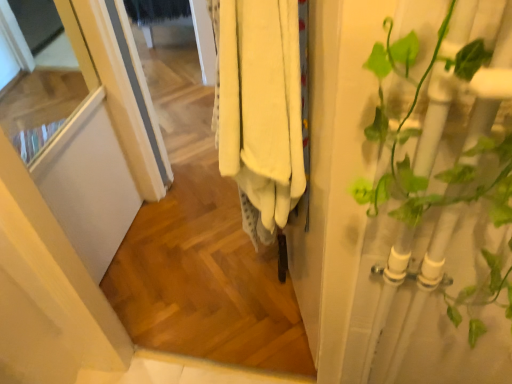
The image size is (512, 384). What do you see at coordinates (72, 145) in the screenshot?
I see `white matte screen door at left` at bounding box center [72, 145].

What do you see at coordinates (462, 147) in the screenshot? I see `green leafy plant at right` at bounding box center [462, 147].

Describe the element at coordinates (261, 106) in the screenshot. This screenshot has height=384, width=512. I see `white cotton towels at center` at that location.

Locate an element on the screen. The height and width of the screenshot is (384, 512). white matte screen door at left is located at coordinates (72, 145).

Is point (245, 109) positioned before point (4, 129)?

Yes, it is in front of point (4, 129).

Are white cotton towels at center and white matte screen door at left making contact?

No, white cotton towels at center is not touching white matte screen door at left.

Considering the sizes of objects white cotton towels at center and white matte screen door at left in the image provided, who is smaller, white cotton towels at center or white matte screen door at left?

Smaller between the two is white cotton towels at center.

From a real-world perspective, which is physically above, white cotton towels at center or white matte screen door at left?

white cotton towels at center is physically above.

Would you say white matte screen door at left is a long distance from green leafy plant at right?

Absolutely, white matte screen door at left is distant from green leafy plant at right.

From a real-world perspective, which is physically above, white matte screen door at left or green leafy plant at right?

From a 3D spatial view, green leafy plant at right is above.

Considering the positions of point (123, 189) and point (488, 8), is point (123, 189) closer or farther from the camera than point (488, 8)?

Point (123, 189) is farther from the camera than point (488, 8).

Is the depth of white matte screen door at left greater than that of green leafy plant at right?

Yes, white matte screen door at left is further from the camera.

Is green leafy plant at right oriented towards white cotton towels at center?

No, green leafy plant at right does not turn towards white cotton towels at center.

Based on the photo, measure the distance from green leafy plant at right to white cotton towels at center.

They are 35.85 centimeters apart.

Where is `houseplant beneath the white cotton towels at center (from a real-world perspective)`? The width and height of the screenshot is (512, 384). houseplant beneath the white cotton towels at center (from a real-world perspective) is located at coordinates (462, 147).

Are green leafy plant at right and white cotton towels at center located far from each other?

No.

Who is taller, green leafy plant at right or white matte screen door at left?

white matte screen door at left is taller.

From a real-world perspective, between green leafy plant at right and white matte screen door at left, who is vertically lower?

white matte screen door at left, from a real-world perspective.

Between green leafy plant at right and white matte screen door at left, which one has smaller width?

green leafy plant at right.

Is white matte screen door at left at the back of green leafy plant at right?

No, green leafy plant at right's orientation is not away from white matte screen door at left.

Between white cotton towels at center and green leafy plant at right, which one has larger size?

white cotton towels at center.

Which is in front, white cotton towels at center or green leafy plant at right?

green leafy plant at right is more forward.

From a real-world perspective, is white cotton towels at center physically above green leafy plant at right?

Correct, in the physical world, white cotton towels at center is higher than green leafy plant at right.

Are white matte screen door at left and white cotton towels at center located far from each other?

Yes.

Is white matte screen door at left positioned in front of white cotton towels at center?

No, white matte screen door at left is further to the viewer.

In terms of height, does white matte screen door at left look taller or shorter compared to white cotton towels at center?

Clearly, white matte screen door at left is taller compared to white cotton towels at center.

From the image's perspective, is white matte screen door at left over white cotton towels at center?

Yes, from the image's perspective, white matte screen door at left is over white cotton towels at center.

Where is `closet that appears below the white matte screen door at left (from the image's perspective)`? closet that appears below the white matte screen door at left (from the image's perspective) is located at coordinates (261, 106).

The width and height of the screenshot is (512, 384). I want to click on screen door beneath the green leafy plant at right (from a real-world perspective), so click(x=72, y=145).

Estimate the real-world distances between objects in this image. Which object is closer to white matte screen door at left, white cotton towels at center or green leafy plant at right?

Among the two, white cotton towels at center is located nearer to white matte screen door at left.

Estimate the real-world distances between objects in this image. Which object is further from green leafy plant at right, white cotton towels at center or white matte screen door at left?

Among the two, white matte screen door at left is located further to green leafy plant at right.

Which object lies nearer to the anchor point white cotton towels at center, white matte screen door at left or green leafy plant at right?

The object closer to white cotton towels at center is green leafy plant at right.

From the image, which object appears to be farther from white cotton towels at center, green leafy plant at right or white matte screen door at left?

Based on the image, white matte screen door at left appears to be further to white cotton towels at center.

Which object lies further to the anchor point white matte screen door at left, green leafy plant at right or white cotton towels at center?

green leafy plant at right.

Estimate the real-world distances between objects in this image. Which object is closer to green leafy plant at right, white matte screen door at left or white cotton towels at center?

Based on the image, white cotton towels at center appears to be nearer to green leafy plant at right.

Where is `closet between white matte screen door at left and green leafy plant at right`? closet between white matte screen door at left and green leafy plant at right is located at coordinates (261, 106).